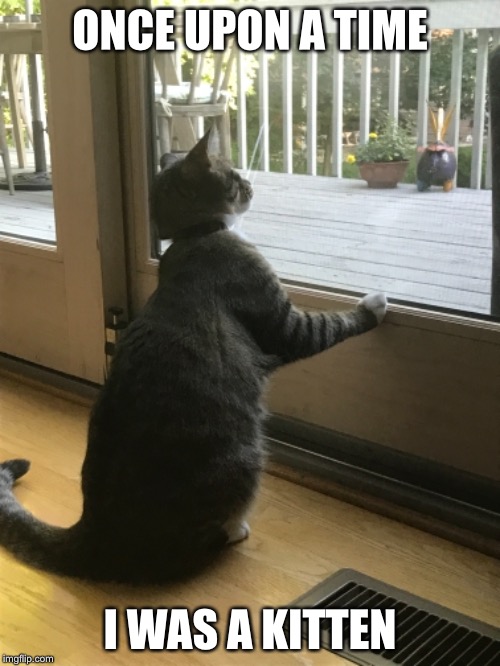
In order to click on wooden floor in this screenshot , I will do `click(374, 539)`.